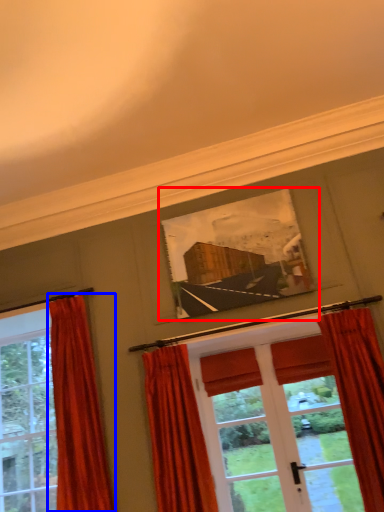
Question: Which object appears closest to the camera in this image, picture frame (highlighted by a red box) or curtain (highlighted by a blue box)?

Choices:
 (A) picture frame
 (B) curtain

Answer: (B)